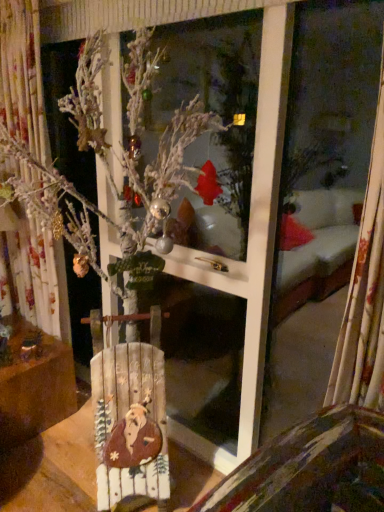
Question: Is the depth of wooden sign at center greater than that of wooden sign at lower left?

Choices:
 (A) yes
 (B) no

Answer: (B)

Question: Is wooden sign at center positioned before wooden sign at lower left?

Choices:
 (A) yes
 (B) no

Answer: (A)

Question: Can you confirm if wooden sign at center is positioned to the right of wooden sign at lower left?

Choices:
 (A) no
 (B) yes

Answer: (B)

Question: Is wooden sign at center oriented towards wooden sign at lower left?

Choices:
 (A) no
 (B) yes

Answer: (A)

Question: Is wooden sign at center far away from wooden sign at lower left?

Choices:
 (A) yes
 (B) no

Answer: (B)

Question: Is wooden sign at center touching wooden sign at lower left?

Choices:
 (A) yes
 (B) no

Answer: (B)

Question: Could you tell me if wooden sign at lower left is facing wooden sign at center?

Choices:
 (A) yes
 (B) no

Answer: (A)

Question: Can you confirm if wooden sign at lower left is wider than wooden sign at center?

Choices:
 (A) no
 (B) yes

Answer: (B)

Question: Is wooden sign at lower left turned away from wooden sign at center?

Choices:
 (A) no
 (B) yes

Answer: (A)

Question: From the image's perspective, is wooden sign at lower left located beneath wooden sign at center?

Choices:
 (A) yes
 (B) no

Answer: (A)

Question: Can you confirm if wooden sign at lower left is thinner than wooden sign at center?

Choices:
 (A) no
 (B) yes

Answer: (A)

Question: Would you say wooden sign at lower left is outside wooden sign at center?

Choices:
 (A) no
 (B) yes

Answer: (B)

Question: In terms of size, does wooden sign at lower left appear bigger or smaller than wooden sign at center?

Choices:
 (A) small
 (B) big

Answer: (B)